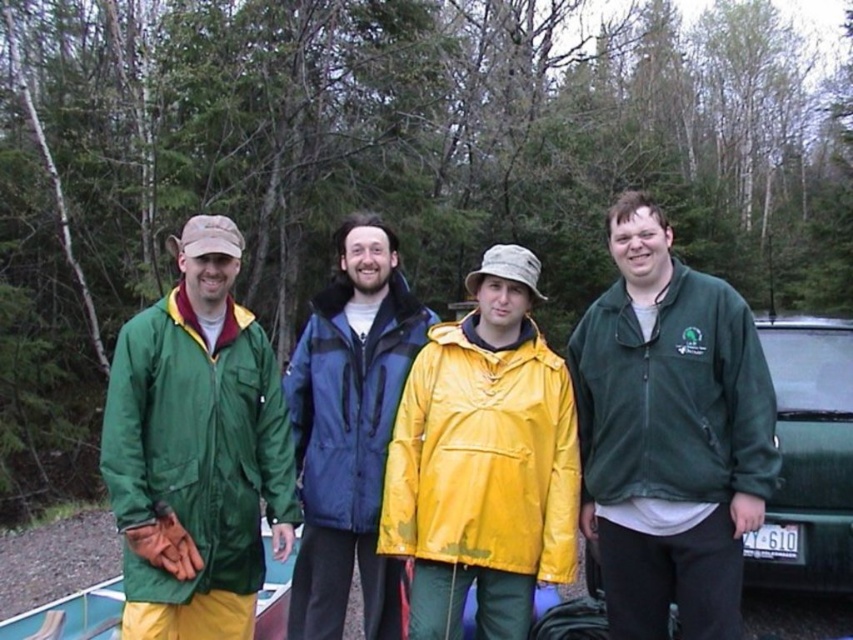
Question: Is yellow matte jacket at center smaller than green matte car at right?

Choices:
 (A) yes
 (B) no

Answer: (A)

Question: Which point appears farthest from the camera in this image?

Choices:
 (A) pos(68,628)
 (B) pos(764,573)

Answer: (B)

Question: Among these points, which one is farthest from the camera?

Choices:
 (A) (717, 413)
 (B) (479, 364)
 (C) (323, 516)

Answer: (C)

Question: Can you confirm if green matte car at right is wider than green plastic boat at lower left?

Choices:
 (A) yes
 (B) no

Answer: (A)

Question: Based on their relative distances, which object is nearer to the green plastic boat at lower left?

Choices:
 (A) yellow matte jacket at center
 (B) green matte car at right
 (C) green fleece jacket at right

Answer: (A)

Question: Does green fleece jacket at right have a greater width compared to blue/gray synthetic jacket at center?

Choices:
 (A) no
 (B) yes

Answer: (B)